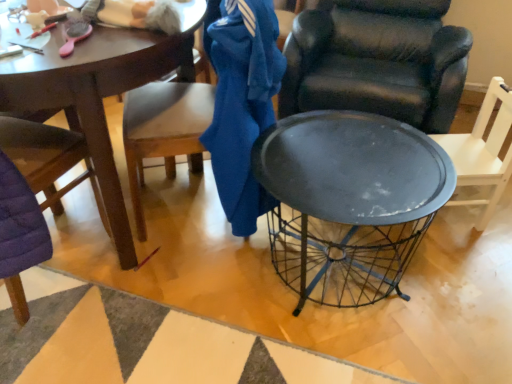
The width and height of the screenshot is (512, 384). Identify the location of vacant location below matte black chair at right, positioned as the fourth chair in left-to-right order (from a real-world perspective). (449, 219).